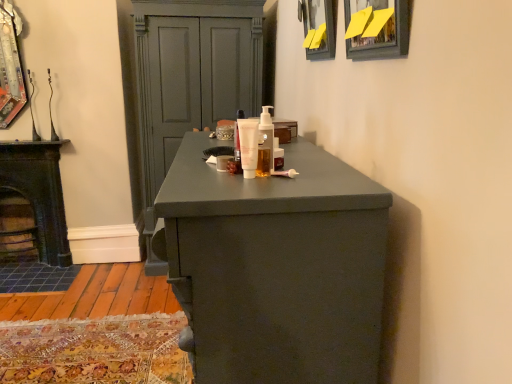
Find the location of `vacant space to the left of white matte tube at center`. vacant space to the left of white matte tube at center is located at coordinates (189, 158).